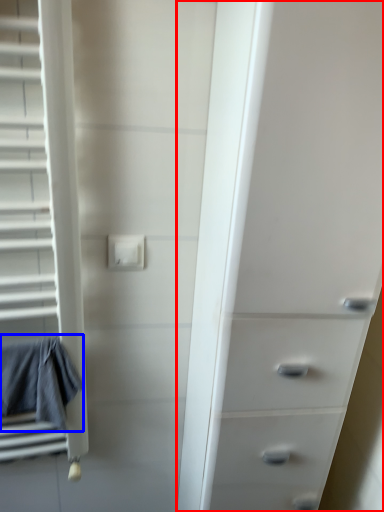
Question: Which object appears farthest to the camera in this image, chest of drawers (highlighted by a red box) or bath towel (highlighted by a blue box)?

Choices:
 (A) chest of drawers
 (B) bath towel

Answer: (B)